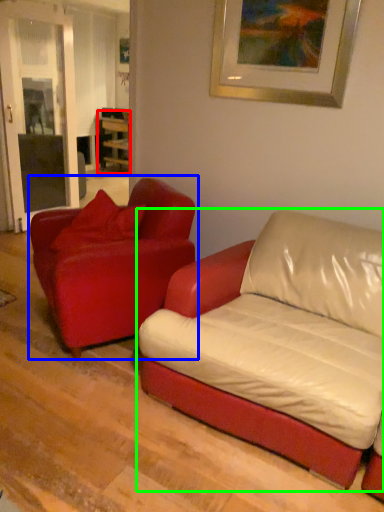
Question: Based on their relative distances, which object is farther from table (highlighted by a red box)? Choose from studio couch (highlighted by a blue box) and studio couch (highlighted by a green box).

Choices:
 (A) studio couch
 (B) studio couch

Answer: (B)